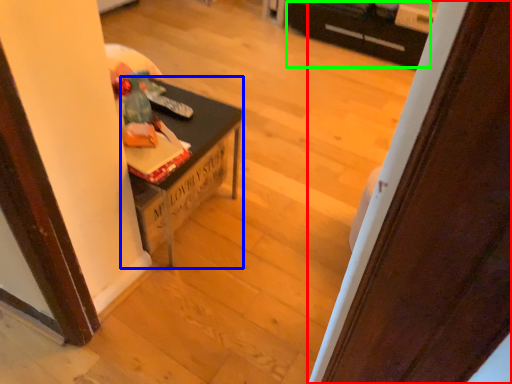
Question: Which is nearer to the door (highlighted by a red box)? table (highlighted by a blue box) or drawer (highlighted by a green box).

Choices:
 (A) table
 (B) drawer

Answer: (A)